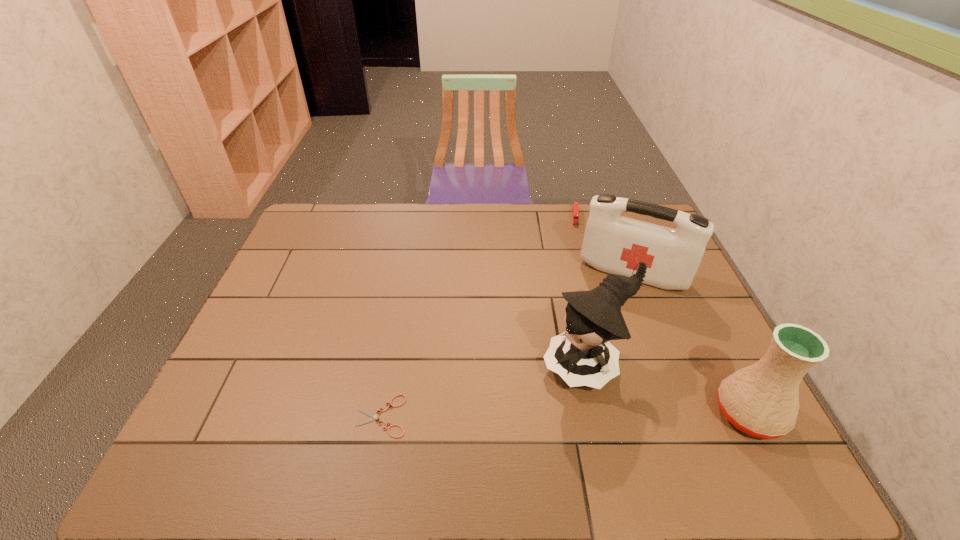
Locate an element on the screen. vacant area between the pottery and the doll is located at coordinates (668, 390).

Find the location of a particular element. The width and height of the screenshot is (960, 540). vacant area that lies between the fourth nearest object and the pottery is located at coordinates (690, 344).

Locate an element on the screen. unoccupied position between the stapler and the pottery is located at coordinates (661, 315).

The image size is (960, 540). I want to click on vacant region between the shears and the doll, so click(x=485, y=391).

Image resolution: width=960 pixels, height=540 pixels. I want to click on vacant area that lies between the leftmost object and the doll, so click(x=485, y=391).

At what (x,y) coordinates should I click in order to perform the action: click on free space between the pottery and the fourth tallest object. Please return your answer as a coordinate pair (x, y). The width and height of the screenshot is (960, 540). Looking at the image, I should click on (661, 315).

The width and height of the screenshot is (960, 540). I want to click on free spot between the pottery and the doll, so click(x=668, y=390).

Identify which object is the third nearest to the pottery. Please provide its 2D coordinates. Your answer should be formatted as a tuple, i.e. [(x, y)], where the tuple contains the x and y coordinates of a point satisfying the conditions above.

[(575, 210)]

Locate which object ranks third in proximity to the doll. Please provide its 2D coordinates. Your answer should be formatted as a tuple, i.e. [(x, y)], where the tuple contains the x and y coordinates of a point satisfying the conditions above.

[(373, 416)]

This screenshot has width=960, height=540. I want to click on free space that satisfies the following two spatial constraints: 1. on the back side of the pottery; 2. on the left side of the shears, so click(x=382, y=414).